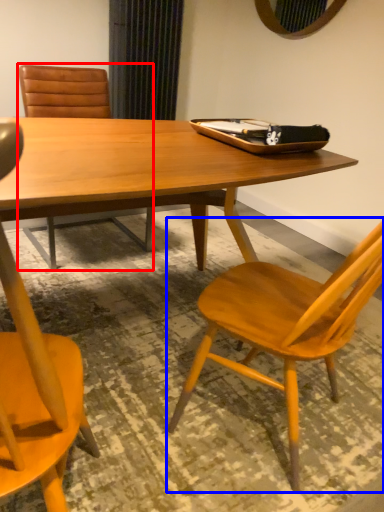
Question: Which point is closer to the camera, chair (highlighted by a red box) or chair (highlighted by a blue box)?

Choices:
 (A) chair
 (B) chair

Answer: (B)